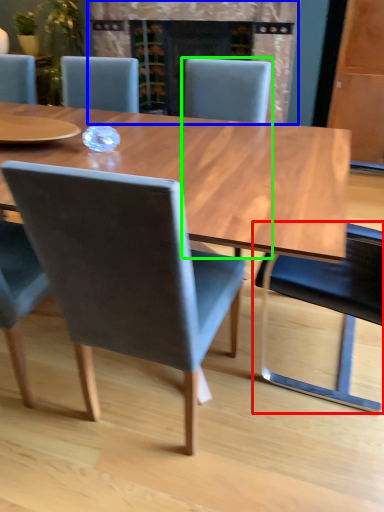
Question: Considering the real-world distances, which object is closest to chair (highlighted by a red box)? fireplace (highlighted by a blue box) or chair (highlighted by a green box).

Choices:
 (A) fireplace
 (B) chair

Answer: (B)